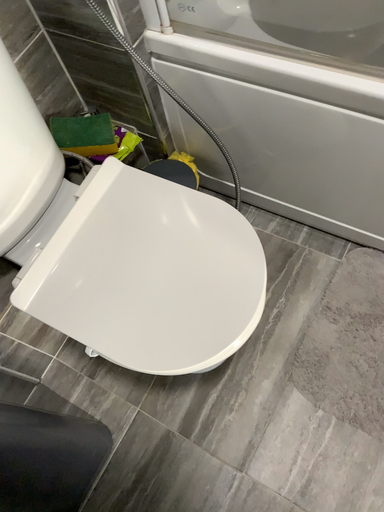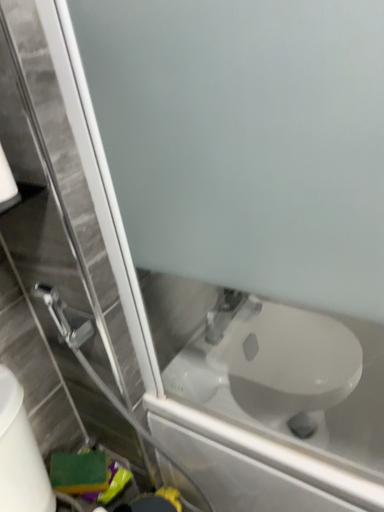
Question: Which way did the camera rotate in the video?

Choices:
 (A) rotated upward
 (B) rotated downward

Answer: (A)